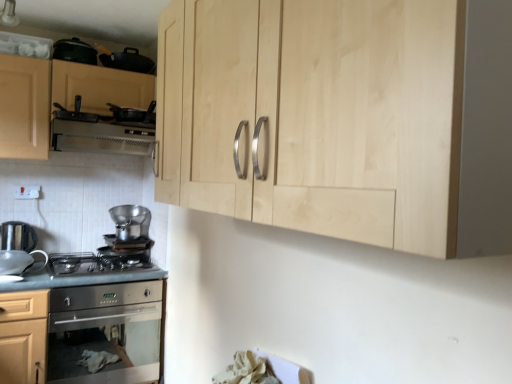
Question: Can you confirm if matte black pan at upper left, which is the fifth appliance from bottom to top, is taller than black matte frying pan at upper left, the 2th appliance from the top?

Choices:
 (A) yes
 (B) no

Answer: (A)

Question: Are matte black pan at upper left, which is the fifth appliance from bottom to top, and black matte frying pan at upper left, the 2th appliance from the top, making contact?

Choices:
 (A) no
 (B) yes

Answer: (A)

Question: Is matte black pan at upper left, which is the fifth appliance from bottom to top, to the right of black matte frying pan at upper left, the 4th appliance when ordered from bottom to top, from the viewer's perspective?

Choices:
 (A) no
 (B) yes

Answer: (A)

Question: Considering the relative sizes of matte black pan at upper left, which is the fifth appliance from bottom to top, and black matte frying pan at upper left, the 4th appliance when ordered from bottom to top, in the image provided, is matte black pan at upper left, which is the fifth appliance from bottom to top, wider than black matte frying pan at upper left, the 4th appliance when ordered from bottom to top,?

Choices:
 (A) yes
 (B) no

Answer: (B)

Question: Is matte black pan at upper left, the first appliance positioned from the top, not inside black matte frying pan at upper left, the 2th appliance from the top?

Choices:
 (A) yes
 (B) no

Answer: (A)

Question: In terms of height, does satin silver gas stove at lower left look taller or shorter compared to matte black pan at upper left, which is the fifth appliance from bottom to top?

Choices:
 (A) tall
 (B) short

Answer: (B)

Question: In terms of width, does satin silver gas stove at lower left look wider or thinner when compared to matte black pan at upper left, which is the fifth appliance from bottom to top?

Choices:
 (A) thin
 (B) wide

Answer: (B)

Question: In terms of size, does satin silver gas stove at lower left appear bigger or smaller than matte black pan at upper left, which is the fifth appliance from bottom to top?

Choices:
 (A) small
 (B) big

Answer: (B)

Question: Considering the positions of point (131, 259) and point (67, 51), is point (131, 259) closer or farther from the camera than point (67, 51)?

Choices:
 (A) farther
 (B) closer

Answer: (A)

Question: Is point [x=28, y=240] closer or farther from the camera than point [x=480, y=173]?

Choices:
 (A) farther
 (B) closer

Answer: (A)

Question: In terms of size, does satin silver kettle at lower left, the 5th appliance viewed from the top, appear bigger or smaller than natural wood cabinet at upper center, the 2th cabinetry when ordered from back to front?

Choices:
 (A) small
 (B) big

Answer: (A)

Question: In terms of width, does satin silver kettle at lower left, the 5th appliance viewed from the top, look wider or thinner when compared to natural wood cabinet at upper center, which appears as the 1th cabinetry when viewed from the front?

Choices:
 (A) thin
 (B) wide

Answer: (A)

Question: Which is correct: satin silver kettle at lower left, the first appliance in the bottom-to-top sequence, is inside natural wood cabinet at upper center, the 2th cabinetry viewed from the left, or outside of it?

Choices:
 (A) inside
 (B) outside

Answer: (B)

Question: Is white plastic exhaust hood at upper left taller or shorter than satin silver pot at center, the 2th appliance positioned from the bottom?

Choices:
 (A) tall
 (B) short

Answer: (B)

Question: From the image's perspective, relative to satin silver pot at center, the 2th appliance positioned from the bottom, is white plastic exhaust hood at upper left above or below?

Choices:
 (A) above
 (B) below

Answer: (A)